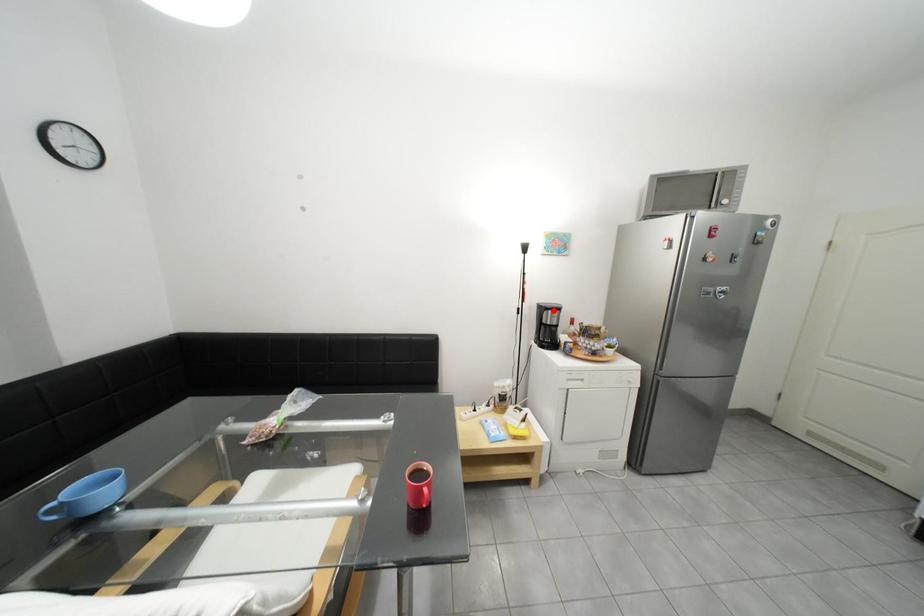
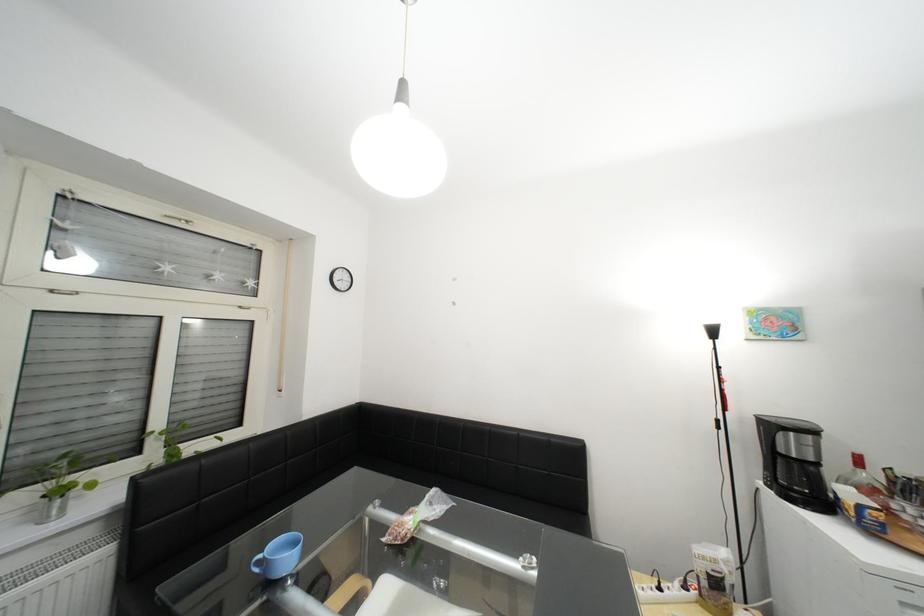
Where in the second image is the point corresponding to the highlighted location from the first image?

(782, 428)